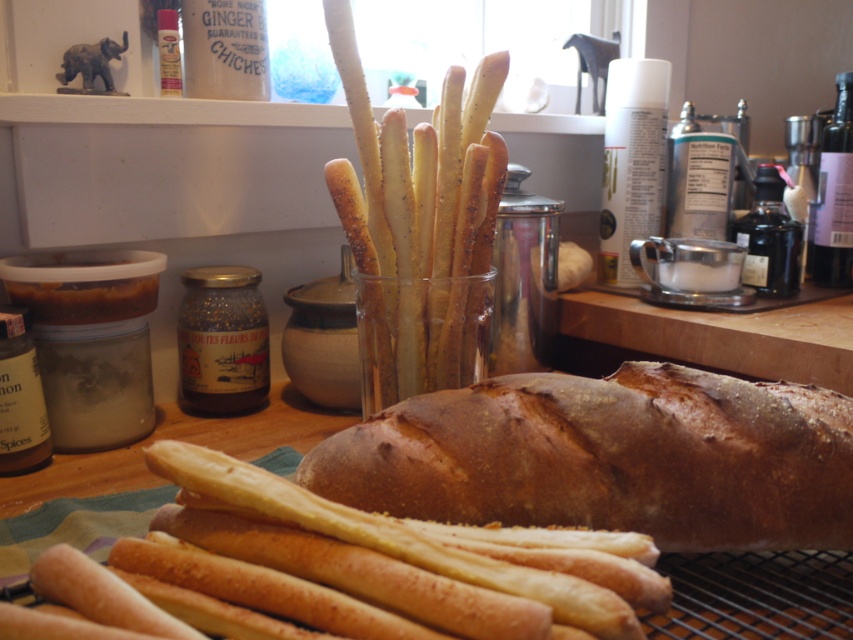
Question: Which of the following is the closest to the observer?

Choices:
 (A) (354, 256)
 (B) (416, 609)
 (C) (543, 520)

Answer: (B)

Question: Is golden breadsticks at center closer to camera compared to golden-brown breadsticks at center?

Choices:
 (A) no
 (B) yes

Answer: (B)

Question: Is brown matte bread at center to the left of golden breadsticks at center from the viewer's perspective?

Choices:
 (A) no
 (B) yes

Answer: (A)

Question: Based on their relative distances, which object is nearer to the brown matte bread at center?

Choices:
 (A) golden-brown breadsticks at center
 (B) golden breadsticks at center

Answer: (B)

Question: Among these objects, which one is nearest to the camera?

Choices:
 (A) golden breadsticks at center
 (B) golden-brown breadsticks at center

Answer: (A)

Question: From the image, what is the correct spatial relationship of brown matte bread at center in relation to golden breadsticks at center?

Choices:
 (A) below
 (B) above

Answer: (B)